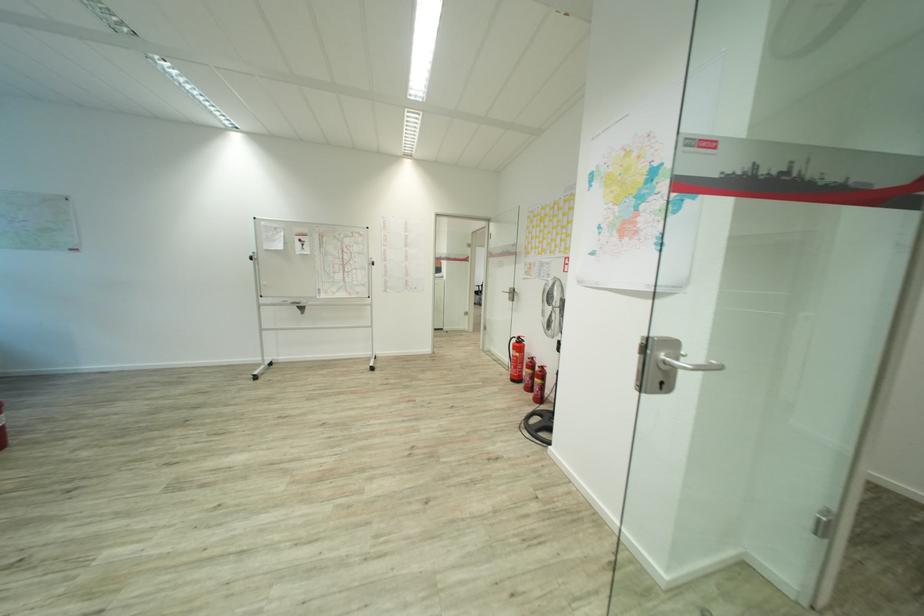
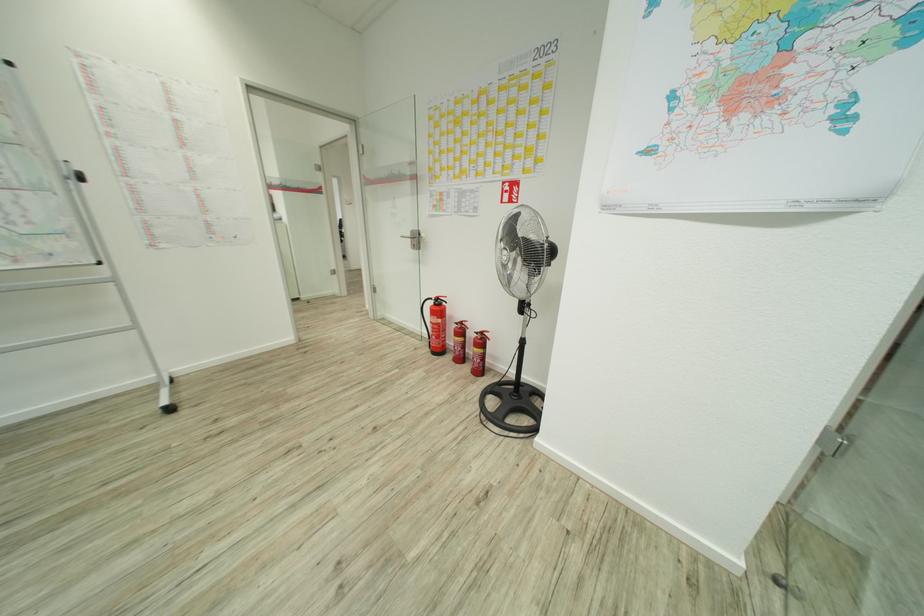
In the second image, find the point that corresponds to [371,262] in the first image.

(80, 176)